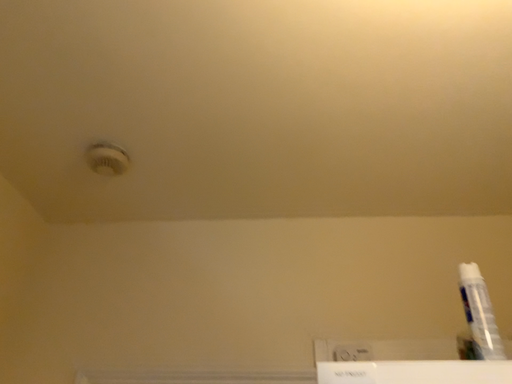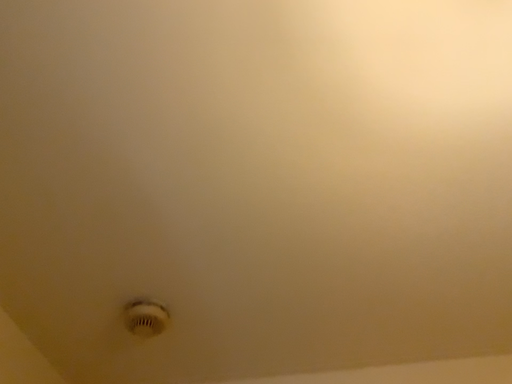
Question: How did the camera likely rotate when shooting the video?

Choices:
 (A) rotated downward
 (B) rotated upward

Answer: (B)